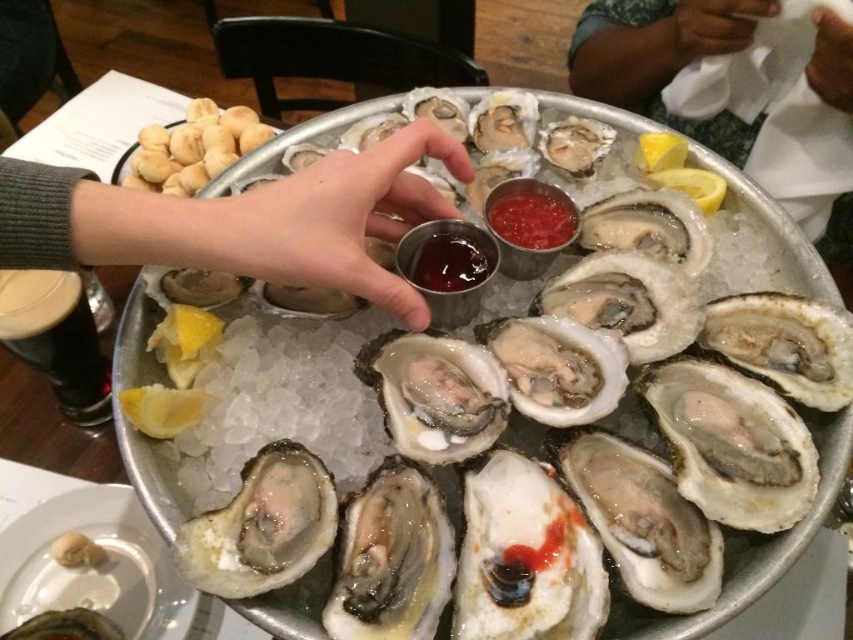
Which is below, dark skin tone at upper right or yellow matte lemon at upper right?

yellow matte lemon at upper right

Between dark skin tone at upper right and yellow matte lemon at upper right, which one is positioned higher?

Positioned higher is dark skin tone at upper right.

Does point (752, 20) lie in front of point (717, 204)?

That is False.

In order to click on dark skin tone at upper right in this screenshot , I will do `click(735, 92)`.

What do you see at coordinates (161, 408) in the screenshot? The width and height of the screenshot is (853, 640). I see `yellow matte lemon at lower left` at bounding box center [161, 408].

This screenshot has width=853, height=640. Find the location of `yellow matte lemon at lower left`. yellow matte lemon at lower left is located at coordinates (161, 408).

Between point (207, 397) and point (677, 189), which one is positioned behind?

Point (677, 189)

I want to click on yellow matte lemon at lower left, so click(x=161, y=408).

Can you confirm if shiny silver oyster shells at center is bigger than yellow matte lemon at lower left?

Correct, shiny silver oyster shells at center is larger in size than yellow matte lemon at lower left.

Between point (138, 561) and point (149, 433), which one is positioned behind?

The point (138, 561) is more distant.

Where is `shiny silver oyster shells at center`? shiny silver oyster shells at center is located at coordinates (94, 568).